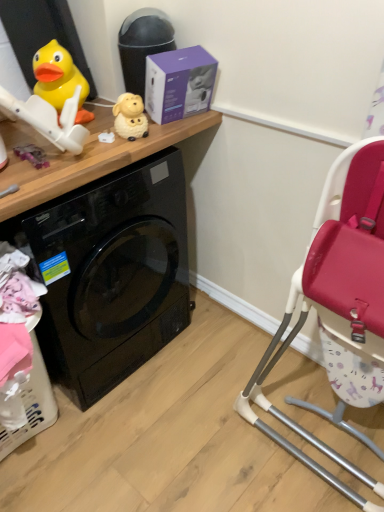
This screenshot has height=512, width=384. I want to click on vacant area that lies in front of black glossy washing machine at left, so click(160, 450).